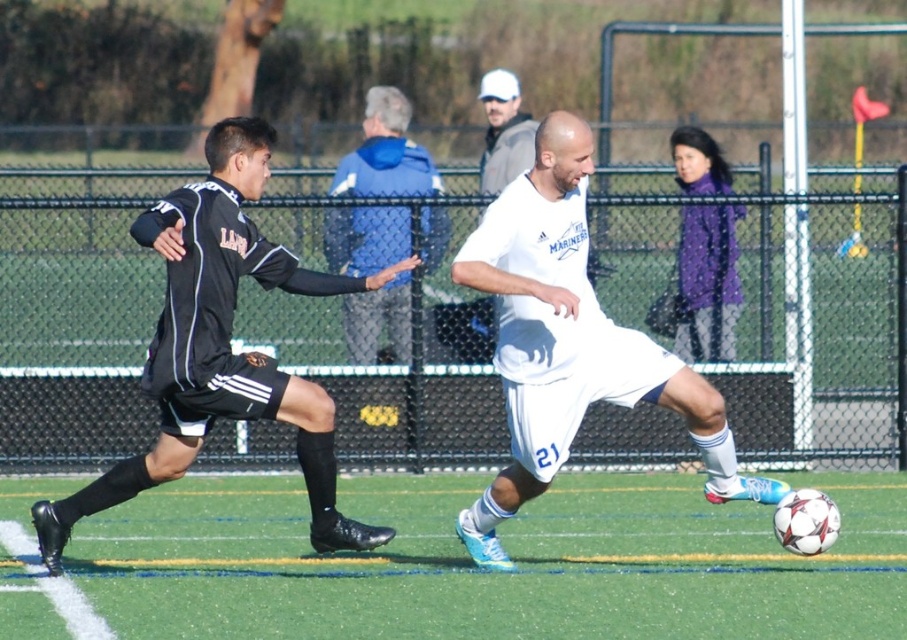
You are a soccer player positioned at the blue fleece jacket at upper center. You want to kick the ball to a teammate located 20 feet away from you. Can you reach the white matte soccer ball at center to make the kick?

The white matte soccer ball at center and blue fleece jacket at upper center are 16.55 feet apart from each other. Since the distance between you and the ball is less than 20 feet, you can reach the white matte soccer ball at center to make the kick.

You are a soccer player trying to pass the ball to a teammate. You see the white matte soccer ball at center and the blue fleece jacket at upper center. Which object is closer to your right side?

The white matte soccer ball at center is to the right of the blue fleece jacket at upper center, so it is closer to your right side.

What is the exact location of the blue fleece jacket at upper center in the image?

The blue fleece jacket at upper center is located at point coordinates of (x=386, y=154).